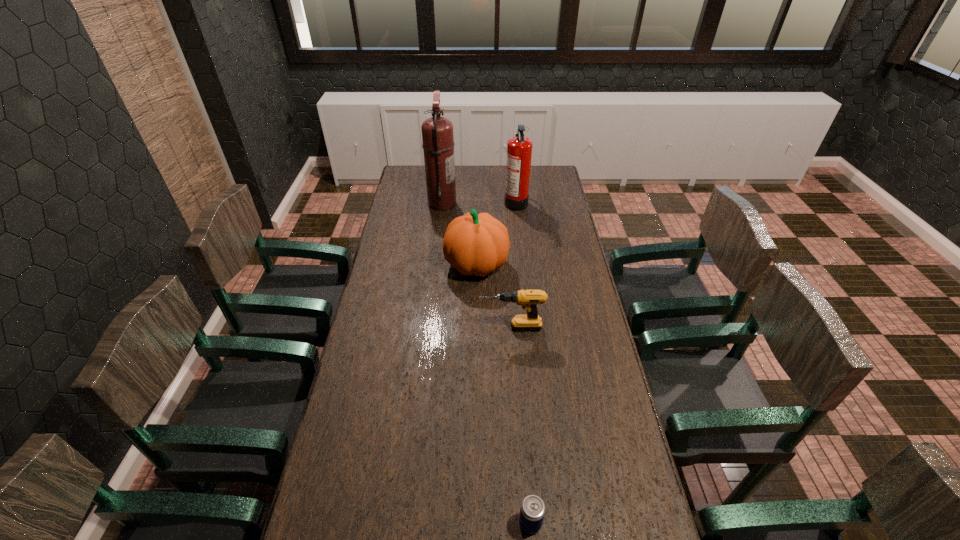
Image resolution: width=960 pixels, height=540 pixels. I want to click on vacant space located on the front-facing side of the left fire extinguisher, so [531, 203].

I want to click on free spot located on the front-facing side of the shorter fire extinguisher, so click(459, 201).

Locate an element on the screen. The image size is (960, 540). vacant space situated on the front-facing side of the shorter fire extinguisher is located at coordinates (457, 201).

Identify the location of free space located 0.120m on the front-facing side of the shorter fire extinguisher. (481, 201).

Identify the location of vacant area located 0.300m on the right of the third nearest object. (580, 265).

You are a GUI agent. You are given a task and a screenshot of the screen. Output one action in this format:
    pyautogui.click(x=<x>, y=<y>)
    Task: Click on the vacant space located at the tip of the second shortest object
    The image size is (960, 540).
    Given the screenshot: What is the action you would take?
    pyautogui.click(x=407, y=328)

Where is `free spot located 0.220m at the tip of the second shortest object`? This screenshot has height=540, width=960. free spot located 0.220m at the tip of the second shortest object is located at coordinates (418, 328).

You are a GUI agent. You are given a task and a screenshot of the screen. Output one action in this format:
    pyautogui.click(x=<x>, y=<y>)
    Task: Click on the free space located at the tip of the second shortest object
    This screenshot has width=960, height=540.
    Given the screenshot: What is the action you would take?
    pyautogui.click(x=398, y=328)

The image size is (960, 540). What are the coordinates of `free space located on the left of the nearest object` in the screenshot? It's located at (384, 522).

Where is `vacant space at the far edge`? This screenshot has width=960, height=540. vacant space at the far edge is located at coordinates click(x=457, y=182).